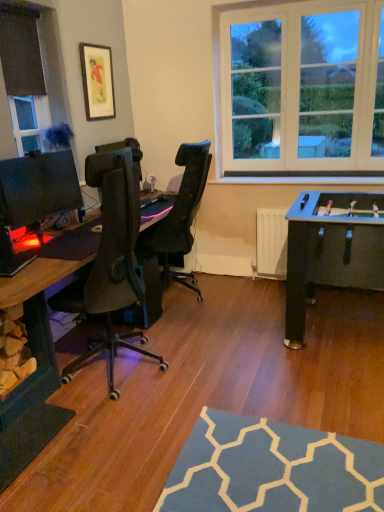
I want to click on free space above matte black monitor at left (from a real-world perspective), so click(x=29, y=156).